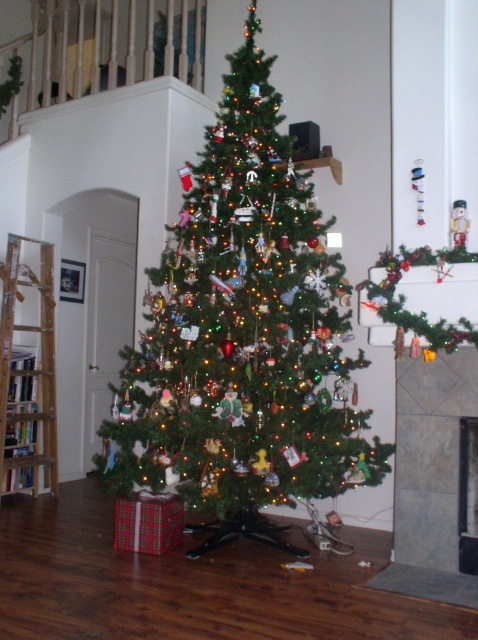
Can you confirm if wooden ladder at left is positioned to the left of white marble fireplace at center?

Correct, you'll find wooden ladder at left to the left of white marble fireplace at center.

Is wooden ladder at left wider than white marble fireplace at center?

Yes.

Which is behind, point (15, 360) or point (477, 464)?

Point (15, 360)

Where is `wooden ladder at left`? The width and height of the screenshot is (478, 640). wooden ladder at left is located at coordinates (28, 369).

Image resolution: width=478 pixels, height=640 pixels. Describe the element at coordinates (431, 456) in the screenshot. I see `gray tile fireplace at lower right` at that location.

Between gray tile fireplace at lower right and white marble fireplace at center, which one is positioned higher?

gray tile fireplace at lower right is higher up.

What do you see at coordinates (431, 456) in the screenshot? The height and width of the screenshot is (640, 478). I see `gray tile fireplace at lower right` at bounding box center [431, 456].

Locate an element on the screen. This screenshot has width=478, height=640. gray tile fireplace at lower right is located at coordinates (431, 456).

Is green matte christmas tree at center to the right of wooden ladder at left from the viewer's perspective?

Yes, green matte christmas tree at center is to the right of wooden ladder at left.

Between point (221, 182) and point (41, 460), which one is positioned in front?

Point (221, 182) is in front.

Identify the location of green matte christmas tree at center. (242, 330).